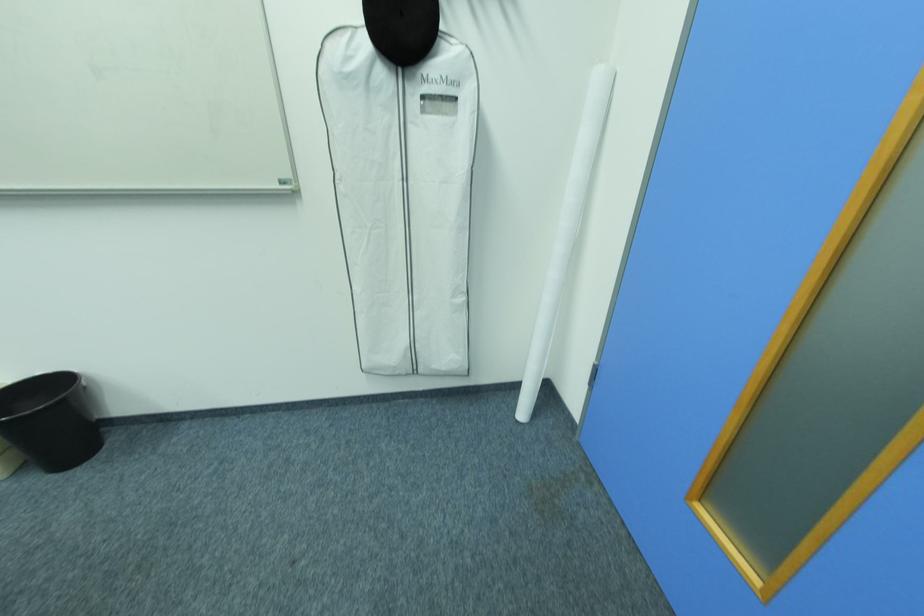
Locate an element on the screen. garment bag zipper is located at coordinates (435, 245).